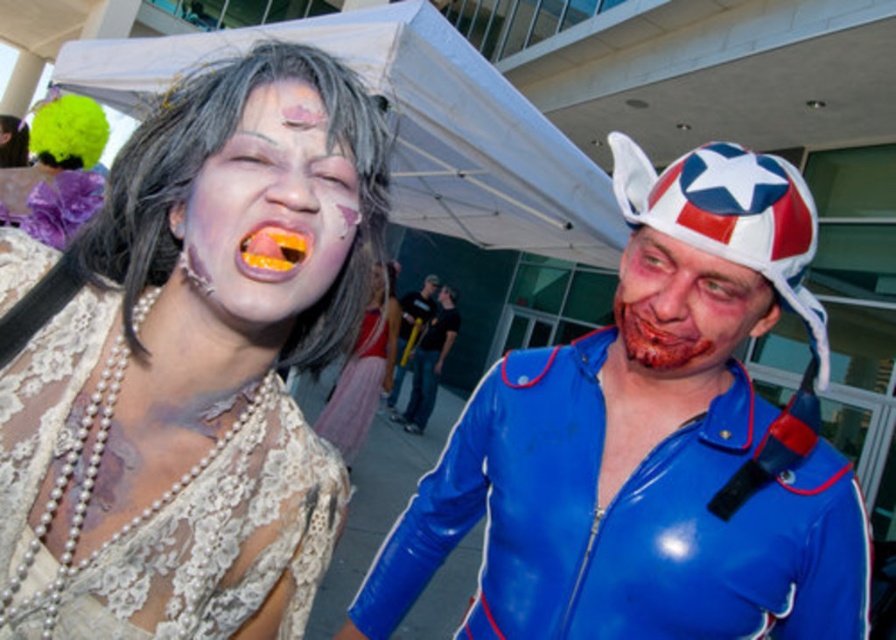
Who is higher up, pearl necklace at upper left or rubberized blue suit at center?

pearl necklace at upper left is above.

Between point (62, 365) and point (442, 291), which one is positioned in front?

Positioned in front is point (62, 365).

The image size is (896, 640). What do you see at coordinates (190, 365) in the screenshot?
I see `pearl necklace at upper left` at bounding box center [190, 365].

You are a GUI agent. You are given a task and a screenshot of the screen. Output one action in this format:
    pyautogui.click(x=<x>, y=<y>)
    Task: Click on the pearl necklace at upper left
    Image resolution: width=896 pixels, height=640 pixels.
    Given the screenshot: What is the action you would take?
    pyautogui.click(x=190, y=365)

Can you confirm if blue glossy jacket at center is positioned below matte white face at center?

Yes, blue glossy jacket at center is below matte white face at center.

Measure the distance from blue glossy jacket at center to matte white face at center.

The distance of blue glossy jacket at center from matte white face at center is 25.47 inches.

Is point (524, 369) closer to viewer compared to point (248, 301)?

No, it is behind (248, 301).

This screenshot has height=640, width=896. What are the coordinates of `blue glossy jacket at center` in the screenshot? It's located at (647, 444).

Between blue glossy jacket at center and gray lace wig at upper left, which one appears on the right side from the viewer's perspective?

From the viewer's perspective, blue glossy jacket at center appears more on the right side.

Looking at this image, who is higher up, blue glossy jacket at center or gray lace wig at upper left?

gray lace wig at upper left

At what (x,y) coordinates should I click in order to perform the action: click on blue glossy jacket at center. Please return your answer as a coordinate pair (x, y). Looking at the image, I should click on (647, 444).

This screenshot has height=640, width=896. In order to click on blue glossy jacket at center in this screenshot , I will do `click(647, 444)`.